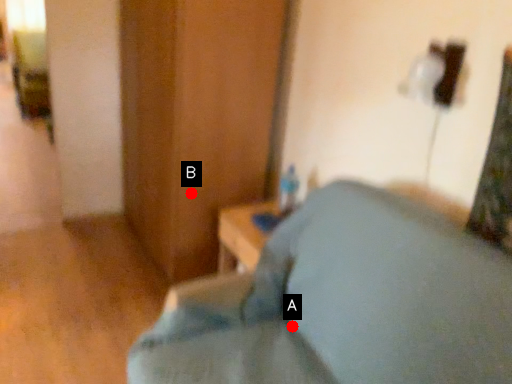
Question: Two points are circled on the image, labeled by A and B beside each circle. Which point appears closest to the camera in this image?

Choices:
 (A) A is closer
 (B) B is closer

Answer: (A)